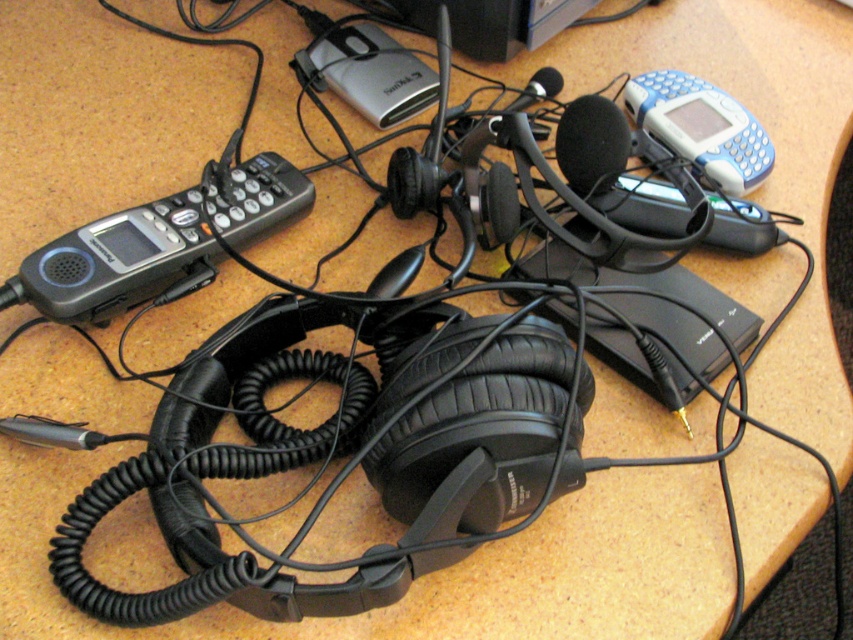
You are organizing a desk clutter and see the blue plastic phone at upper right and the black foam microphone at upper center. Which object is located to the right of the other?

The blue plastic phone at upper right is positioned on the right side of black foam microphone at upper center.

What object is located at the coordinates point (157, 243)?

The point (157, 243) is on the black plastic phone at left.

You are organizing items on a desk and need to locate the black plastic phone at left. According to the coordinates provided, where exactly should you look for it?

The black plastic phone at left is located at point (157,243).